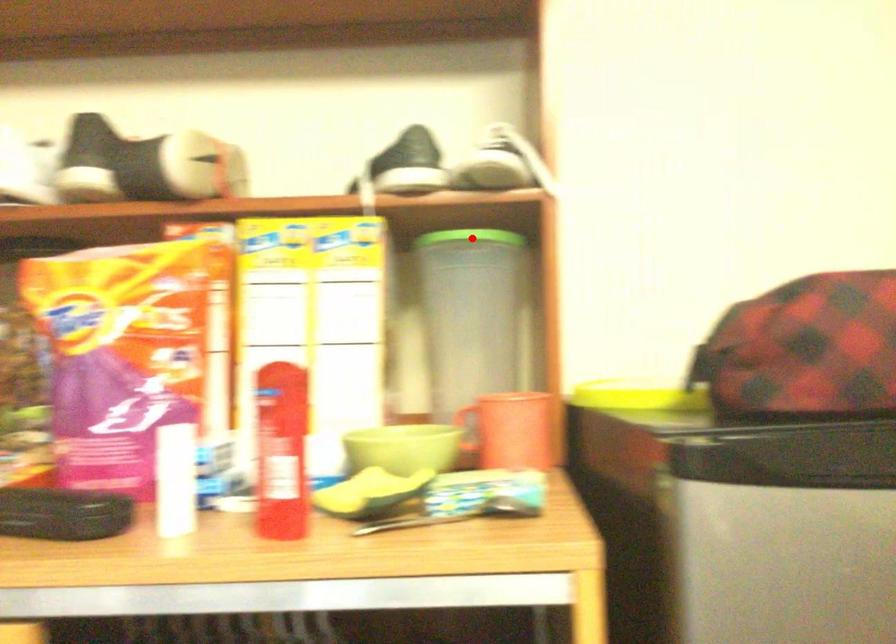
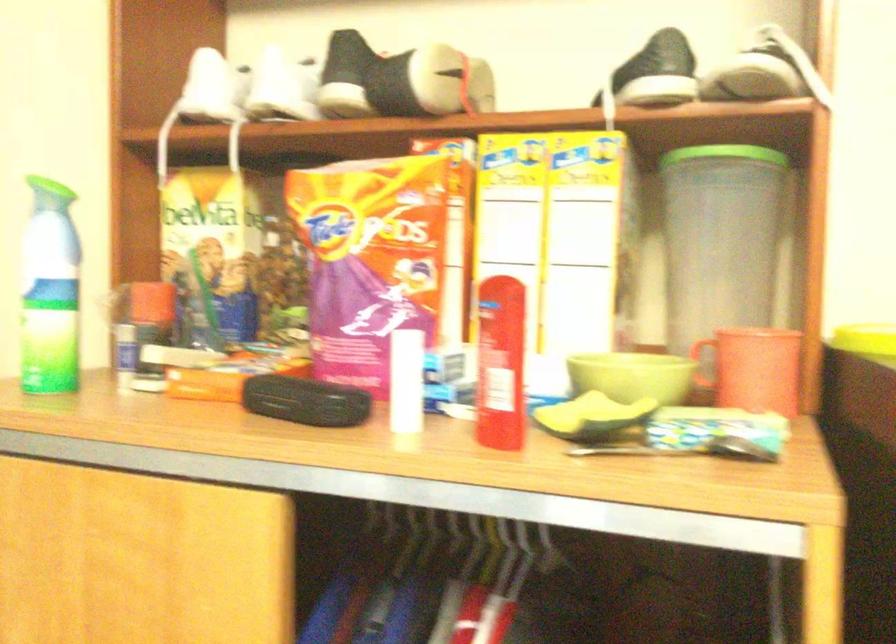
Question: I am providing you with two images of the same scene from different viewpoints. Given a red point in image1, look at the same physical point in image2. Is it:

Choices:
 (A) Closer to the viewpoint
 (B) Farther from the viewpoint

Answer: (A)